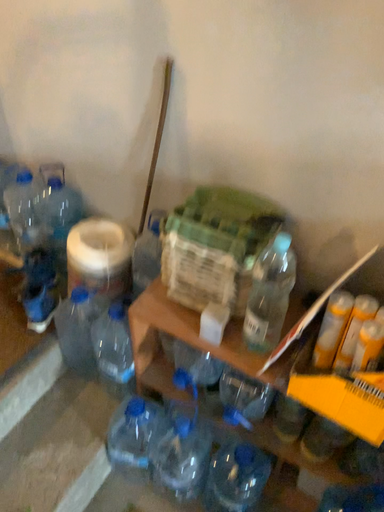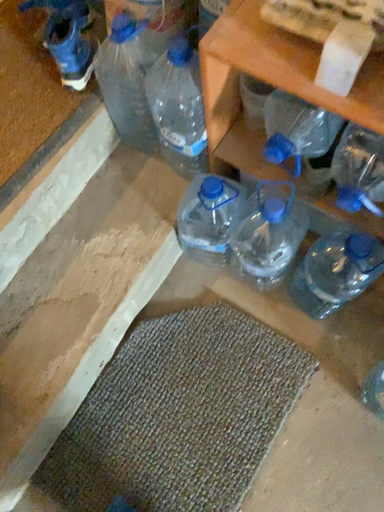
Question: Which way did the camera rotate in the video?

Choices:
 (A) rotated right
 (B) rotated left

Answer: (B)